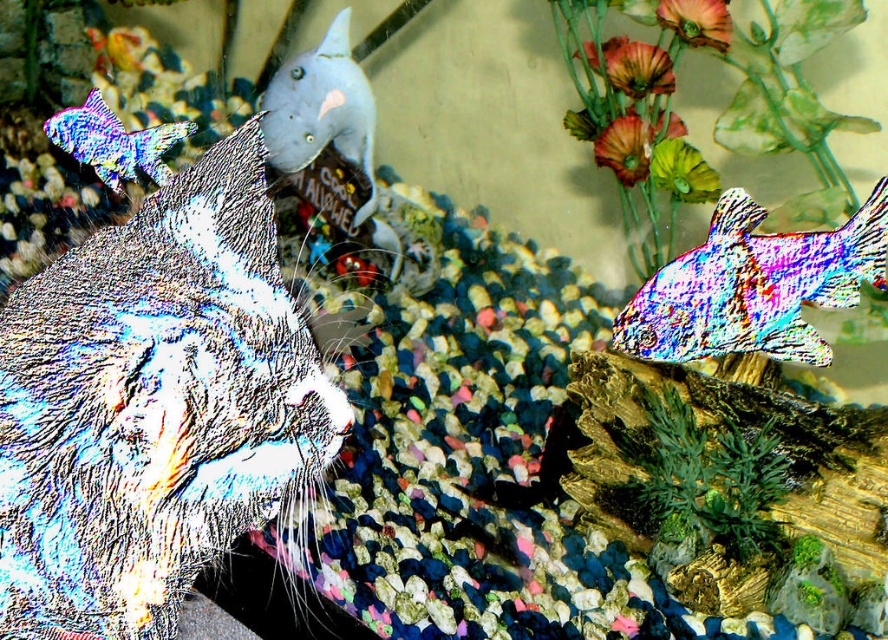
Does shiny iridescent fish at right appear on the left side of shiny metallic fish at upper left?

→ Incorrect, shiny iridescent fish at right is not on the left side of shiny metallic fish at upper left.

Who is positioned more to the right, shiny iridescent fish at right or shiny metallic fish at upper left?

From the viewer's perspective, shiny iridescent fish at right appears more on the right side.

Who is more forward, (758, 323) or (62, 115)?

Point (758, 323) is in front.

Locate an element on the screen. The image size is (888, 640). shiny iridescent fish at right is located at coordinates (752, 285).

Which is more to the right, matte gray fish at upper center or matte pink flower at upper center?

matte pink flower at upper center is more to the right.

Which is behind, point (347, 128) or point (593, 49)?

The point (347, 128) is behind.

Identify the location of matte gray fish at upper center. This screenshot has width=888, height=640. (322, 109).

Does fluffy gray cat at upper left have a lesser width compared to matte orange flower at upper right?

No.

Can you confirm if fluffy gray cat at upper left is positioned to the left of matte orange flower at upper right?

Yes, fluffy gray cat at upper left is to the left of matte orange flower at upper right.

Where is `fluffy gray cat at upper left`? fluffy gray cat at upper left is located at coordinates (153, 392).